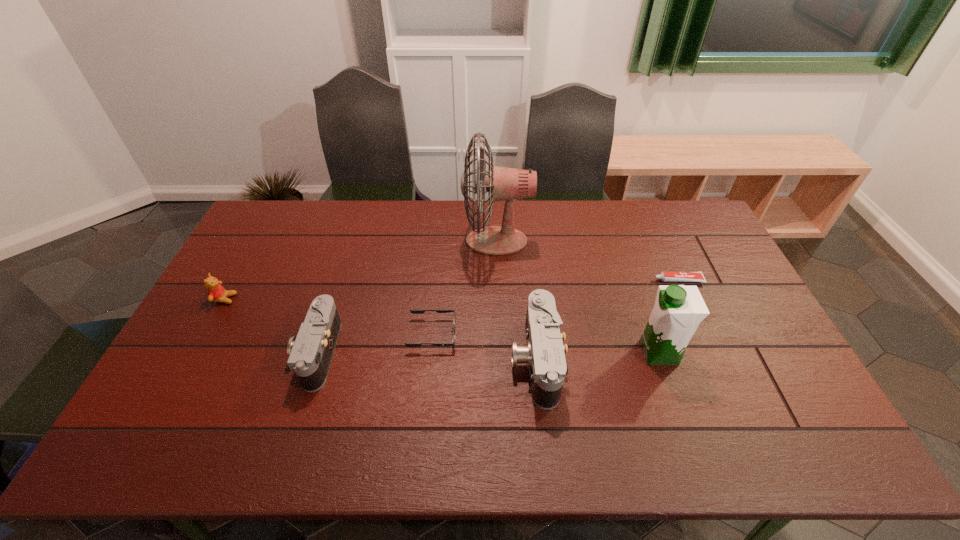
I want to click on object that is the nearest to the fan, so coord(414,311).

Find the location of a particular element. object that can be found as the closest to the shortest object is located at coordinates (678, 310).